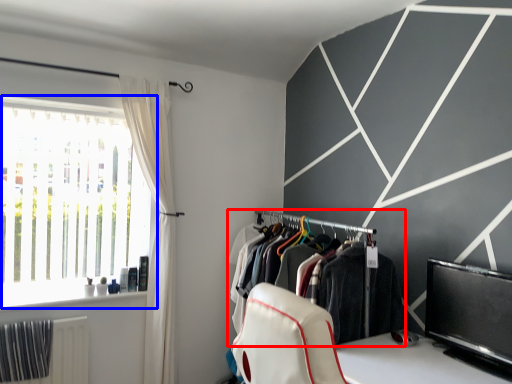
Question: Which object is further to the camera taking this photo, closet (highlighted by a red box) or window (highlighted by a blue box)?

Choices:
 (A) closet
 (B) window

Answer: (B)